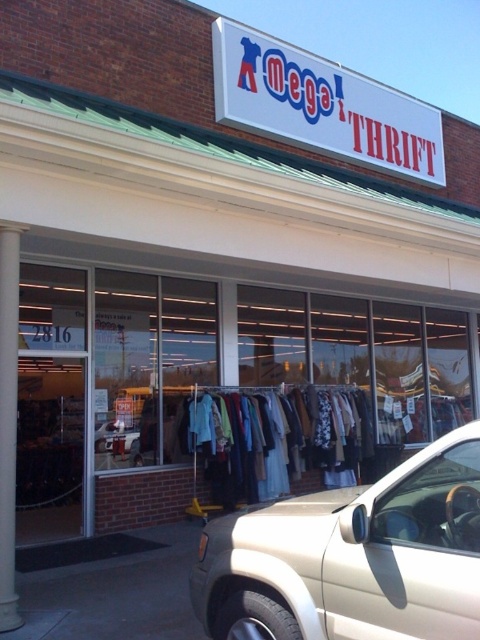
Question: Estimate the real-world distances between objects in this image. Which object is closer to the metallic gold suv at center?

Choices:
 (A) gold metallic suv at center
 (B) white smooth column at left

Answer: (B)

Question: Which of the following is the farthest from the observer?

Choices:
 (A) (0, 432)
 (B) (296, 576)

Answer: (A)

Question: Is gold metallic suv at center thinner than metallic gold suv at center?

Choices:
 (A) no
 (B) yes

Answer: (A)

Question: Is gold metallic suv at center above metallic gold suv at center?

Choices:
 (A) yes
 (B) no

Answer: (A)

Question: Is gold metallic suv at center positioned in front of metallic gold suv at center?

Choices:
 (A) yes
 (B) no

Answer: (A)

Question: Which of the following is the farthest from the observer?

Choices:
 (A) (296, 545)
 (B) (121, 420)

Answer: (B)